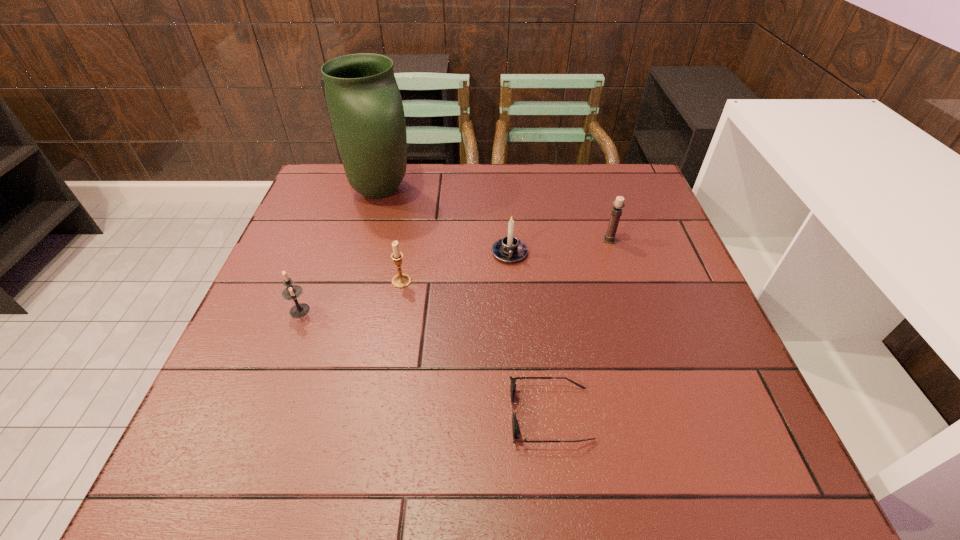
I want to click on free spot between the nearest candle holder and the third farthest candle holder, so click(x=350, y=296).

This screenshot has height=540, width=960. Find the location of `vacant space that is in between the third candle holder from left to right and the tallest object`. vacant space that is in between the third candle holder from left to right and the tallest object is located at coordinates (444, 222).

Identify the location of vacant space that's between the second candle holder from right to left and the third nearest object. (455, 267).

You are a GUI agent. You are given a task and a screenshot of the screen. Output one action in this format:
    pyautogui.click(x=<x>, y=<y>)
    Task: Click on the unoccupied position between the third nearest object and the nearest object
    The height and width of the screenshot is (540, 960).
    Given the screenshot: What is the action you would take?
    pyautogui.click(x=476, y=348)

The height and width of the screenshot is (540, 960). Find the location of `vacant area between the farthest object and the second candle holder from left to right`. vacant area between the farthest object and the second candle holder from left to right is located at coordinates (391, 236).

The width and height of the screenshot is (960, 540). Find the location of `free spot between the vase and the shortest object`. free spot between the vase and the shortest object is located at coordinates (466, 302).

Find the location of a particular element. free space that is in between the leftmost candle holder and the shortest object is located at coordinates (425, 362).

I want to click on vacant area that lies between the third farthest candle holder and the farthest object, so click(391, 236).

The height and width of the screenshot is (540, 960). Find the location of `object that ranks as the fifth closest to the vase`. object that ranks as the fifth closest to the vase is located at coordinates (515, 425).

I want to click on object that is the nearest to the second nearest candle holder, so click(x=292, y=292).